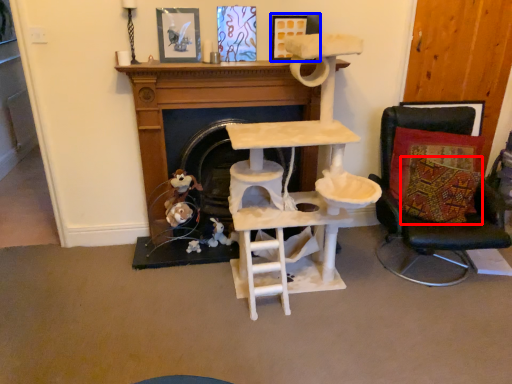
Question: Which object is further to the camera taking this photo, pillow (highlighted by a red box) or picture frame (highlighted by a blue box)?

Choices:
 (A) pillow
 (B) picture frame

Answer: (B)